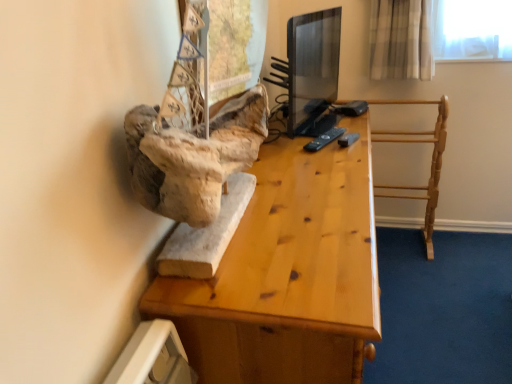
Where is `free point behind black plastic remote at center`? The width and height of the screenshot is (512, 384). free point behind black plastic remote at center is located at coordinates (318, 126).